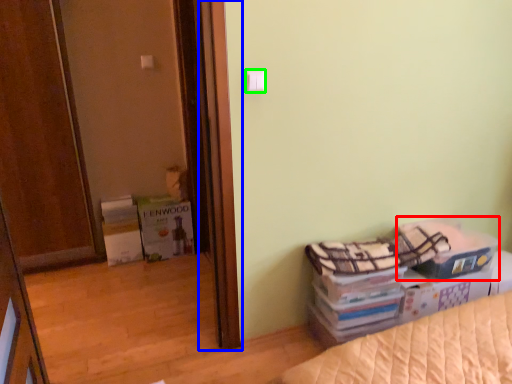
Question: Based on their relative distances, which object is nearer to storage box (highlighted by a red box)? Choose from screen door (highlighted by a blue box) and light switch (highlighted by a green box).

Choices:
 (A) screen door
 (B) light switch

Answer: (A)